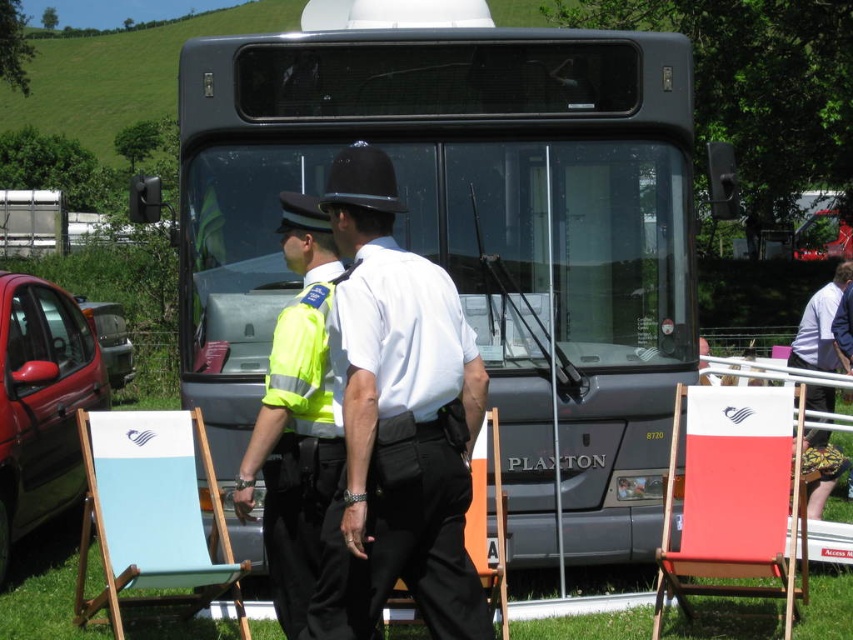
You are a photographer trying to capture both the metallic gray bus at center and the yellow reflective vest at center in a single frame. Since the bus is larger, will you need to adjust your camera angle to include both objects without cropping either?

The metallic gray bus at center is bigger than the yellow reflective vest at center, so you may need to zoom out or move back to ensure both are fully visible in the frame.

You are a pedestrian trying to cross the road safely. You see a metallic gray bus at center and a yellow reflective vest at center. Which object is closer to you?

The metallic gray bus at center is closer to you because the yellow reflective vest at center is behind it.